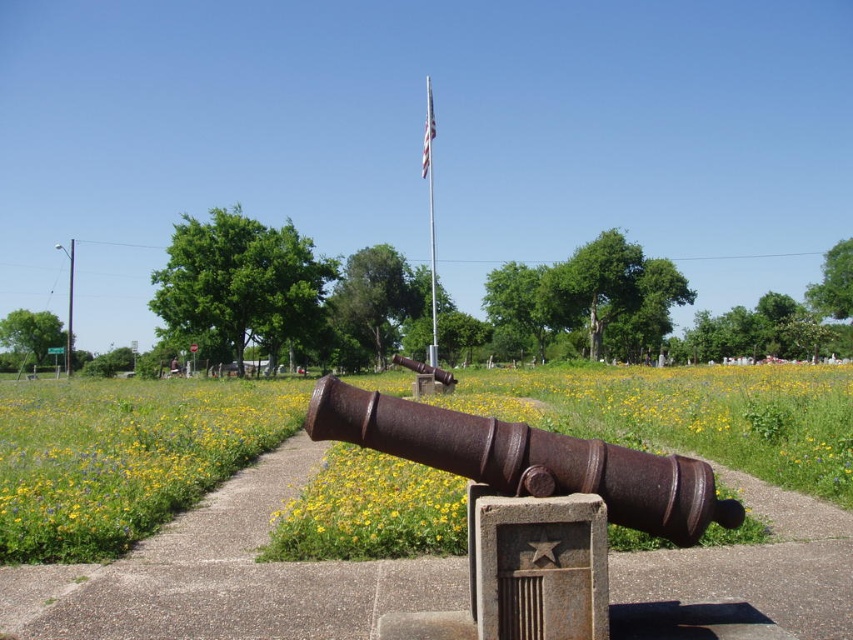
Question: Does green grassy at center have a lesser width compared to brushed metal pole at upper left?

Choices:
 (A) yes
 (B) no

Answer: (B)

Question: Which point appears farthest from the camera in this image?

Choices:
 (A) (422, 150)
 (B) (68, 276)
 (C) (482, 509)

Answer: (B)

Question: Which object is positioned farthest from the rusty metal cannon at center?

Choices:
 (A) white fabric flag at center
 (B) brushed metal pole at upper left

Answer: (B)

Question: Does silver metallic flag pole at center have a greater width compared to white fabric flag at center?

Choices:
 (A) no
 (B) yes

Answer: (B)

Question: Is rusty metal cannon at center closer to camera compared to brushed metal pole at upper left?

Choices:
 (A) no
 (B) yes

Answer: (B)

Question: Which object is closer to the camera taking this photo?

Choices:
 (A) brushed metal pole at upper left
 (B) green grassy at center
 (C) white fabric flag at center
 (D) silver metallic flag pole at center

Answer: (B)